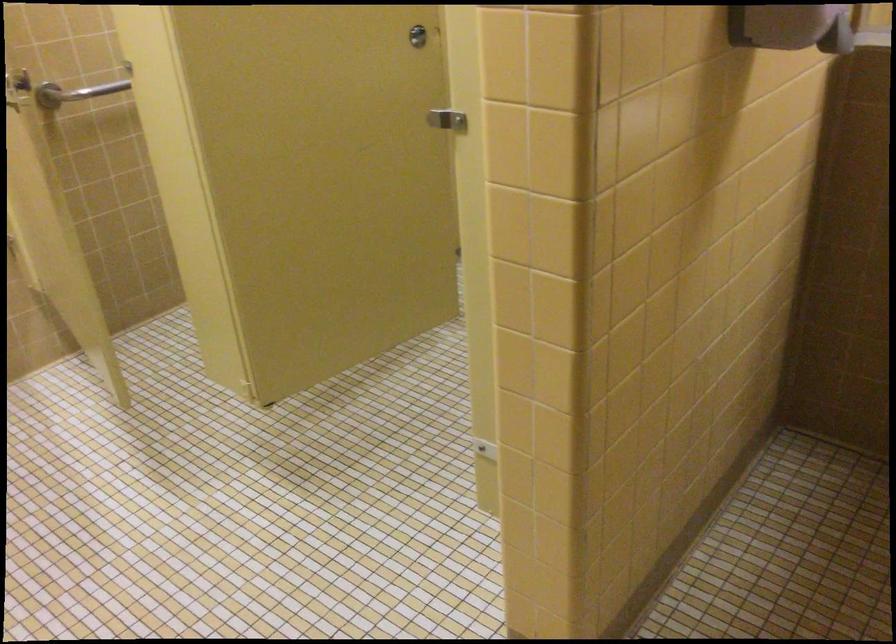
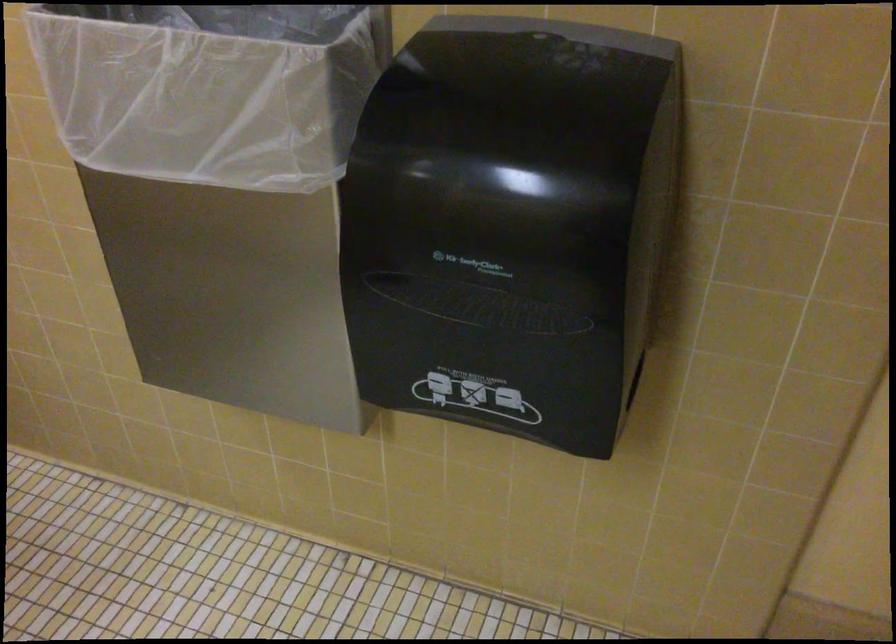
How did the camera likely rotate?

The camera's rotation is toward right-down.